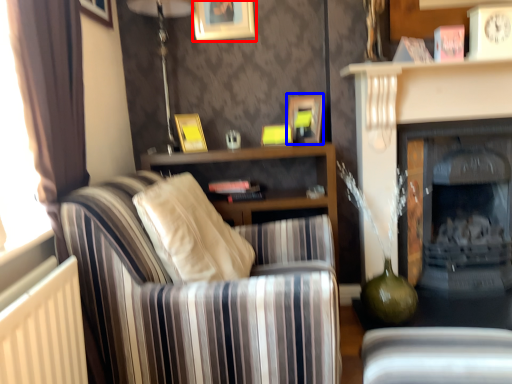
Question: Which object appears closest to the camera in this image, picture frame (highlighted by a red box) or picture frame (highlighted by a blue box)?

Choices:
 (A) picture frame
 (B) picture frame

Answer: (B)